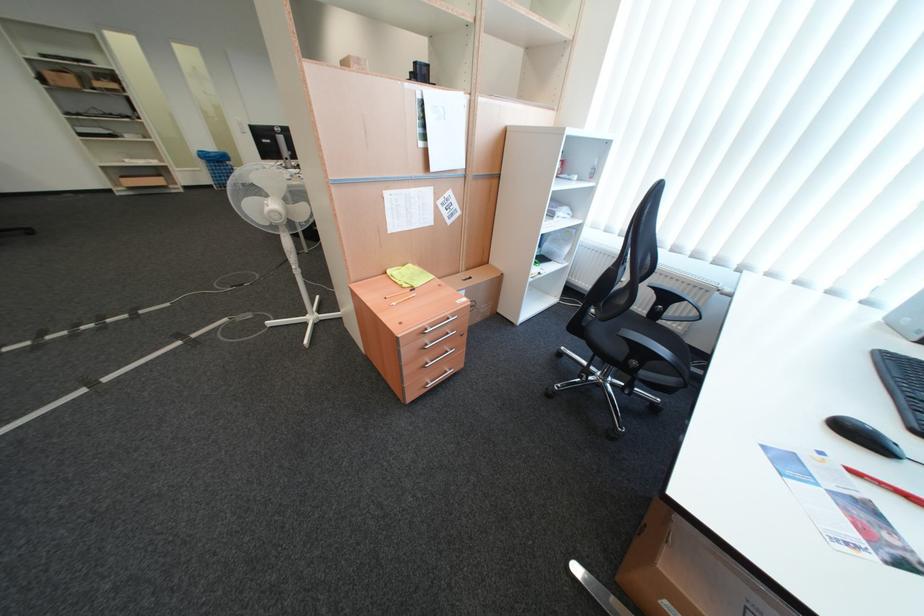
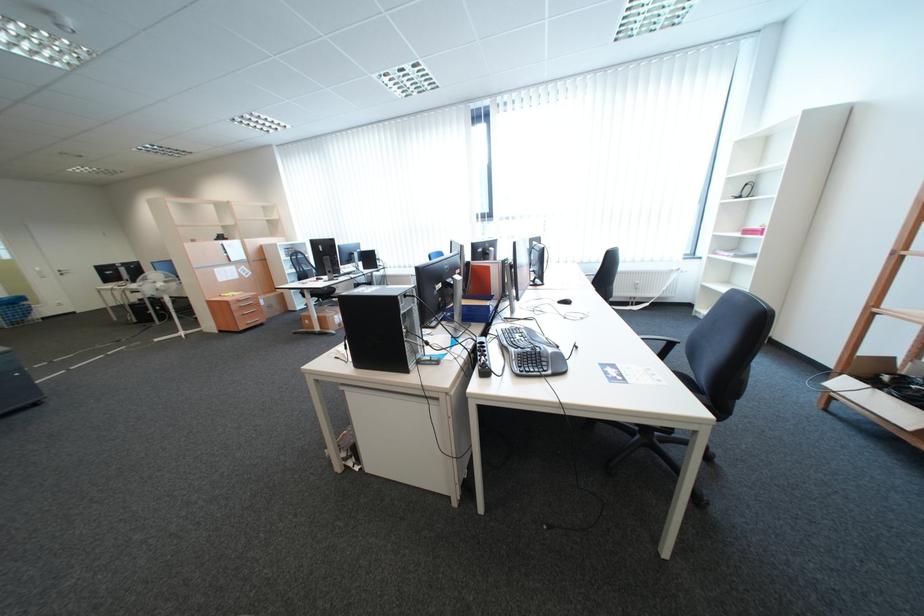
Question: I am providing you with two images of the same scene from different viewpoints. After the viewpoint changes to image2, which objects are now occluded?

Choices:
 (A) black keyboard
 (B) patterned shower curtain
 (C) silver door handle
 (D) computer mouse

Answer: (A)